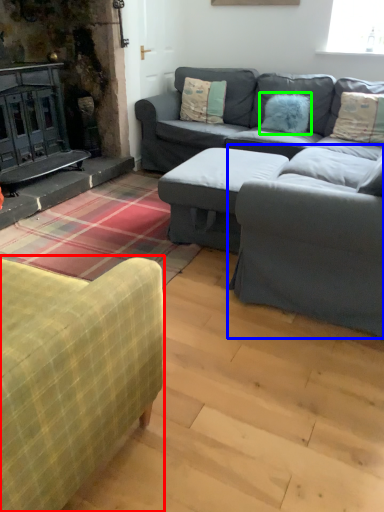
Question: Which is farther away from studio couch (highlighted by a red box)? armchair (highlighted by a blue box) or pillow (highlighted by a green box)?

Choices:
 (A) armchair
 (B) pillow

Answer: (B)